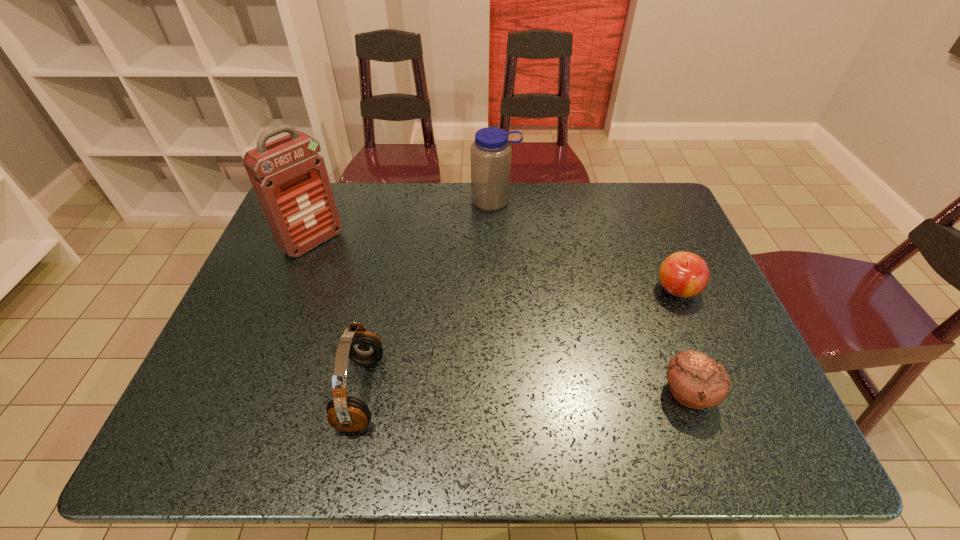
What are the coordinates of `vacant space at the far edge of the desktop` in the screenshot? It's located at (352, 203).

I want to click on vacant region at the near edge of the desktop, so click(x=516, y=381).

The height and width of the screenshot is (540, 960). Find the location of `free space at the right edge`. free space at the right edge is located at coordinates (659, 240).

Where is `vacant space at the far right corner`? Image resolution: width=960 pixels, height=540 pixels. vacant space at the far right corner is located at coordinates [641, 197].

You are a GUI agent. You are given a task and a screenshot of the screen. Output one action in this format:
    pyautogui.click(x=<x>, y=<y>)
    Task: Click on the free area in between the farthest object and the tallest object
    This screenshot has width=960, height=540.
    Given the screenshot: What is the action you would take?
    pyautogui.click(x=404, y=221)

You are a GUI agent. You are given a task and a screenshot of the screen. Output one action in this format:
    pyautogui.click(x=<x>, y=<y>)
    Task: Click on the blank region between the muffin and the first-aid kit
    
    Given the screenshot: What is the action you would take?
    pyautogui.click(x=500, y=318)

This screenshot has height=540, width=960. What are the coordinates of `empty space that is in between the third farthest object and the fourth shortest object` in the screenshot? It's located at (586, 245).

Locate an element on the screen. free space between the third farthest object and the second farthest object is located at coordinates [495, 266].

Identify the location of free space between the second tallest object and the third shortest object. (428, 296).

I want to click on empty space that is in between the third object from right to left and the fourth object from right to left, so click(428, 296).